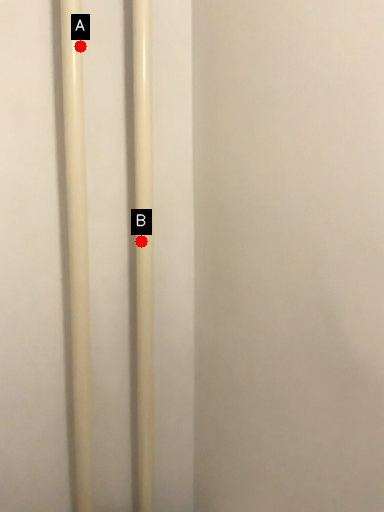
Question: Two points are circled on the image, labeled by A and B beside each circle. Which point is further to the camera?

Choices:
 (A) A is further
 (B) B is further

Answer: (B)